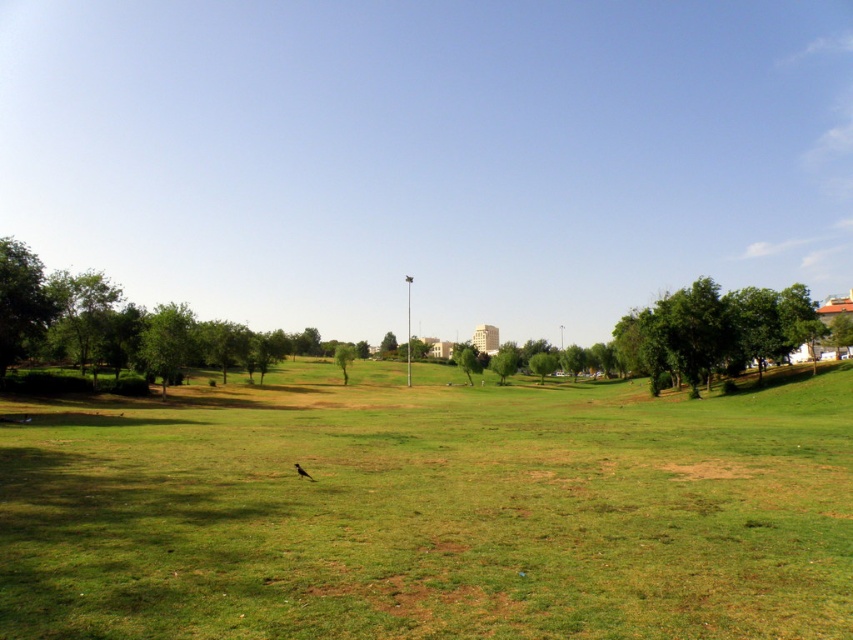
You are standing on the grassy field and see the green leafy tree at left and the green leafy tree at center. Which tree is closer to you?

The green leafy tree at left is closer to you because it is positioned in front of the green leafy tree at center.

You are standing in the open grassy area and want to find a spot where you can see both the green grass at center and the green leafy tree at left clearly. Which object will appear taller from your current position?

The green leafy tree at left will appear taller than the green grass at center because the green grass at center is not as tall as the green leafy tree at left.